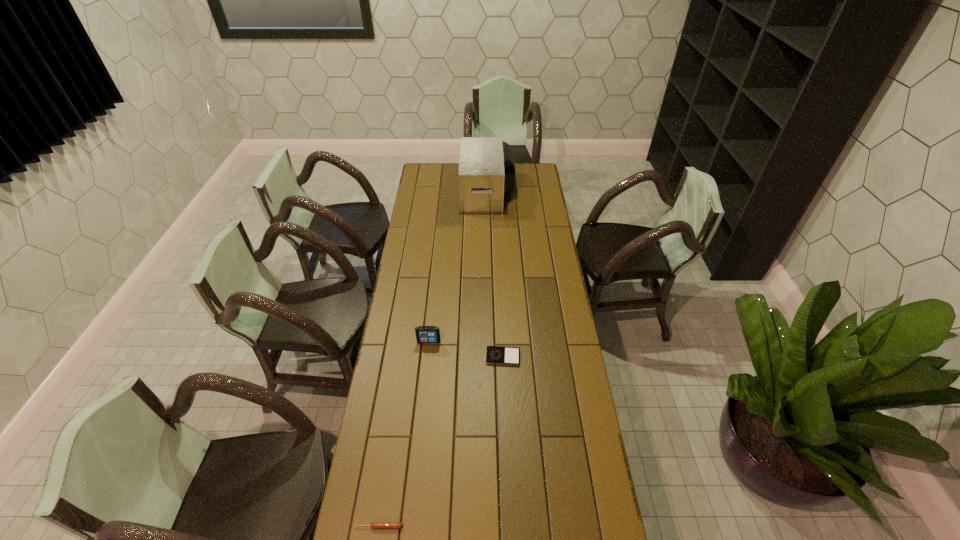
In order to click on vacant space situated on the front-facing side of the tallest object in this screenshot , I will do `click(436, 192)`.

Find the location of a particular element. vacant space located on the front screen of the second farthest object is located at coordinates (424, 381).

Locate an element on the screen. Image resolution: width=960 pixels, height=540 pixels. vacant area located on the right of the sausage is located at coordinates (429, 526).

Find the location of a particular element. The height and width of the screenshot is (540, 960). vacant space situated 0.230m on the back of the shortest object is located at coordinates pyautogui.click(x=501, y=306).

Locate an element on the screen. Image resolution: width=960 pixels, height=540 pixels. object that is at the far edge is located at coordinates (486, 173).

The image size is (960, 540). Find the location of `iPod at the left edge`. iPod at the left edge is located at coordinates (424, 334).

Locate an element on the screen. This screenshot has height=540, width=960. sausage that is positioned at the left edge is located at coordinates (374, 525).

You are a GUI agent. You are given a task and a screenshot of the screen. Output one action in this format:
    pyautogui.click(x=<x>, y=<y>)
    Task: Click on the free location at the far edge
    The image size is (960, 540).
    Given the screenshot: What is the action you would take?
    pyautogui.click(x=456, y=164)

Locate an element on the screen. free location at the left edge is located at coordinates (413, 363).

At what (x,y) coordinates should I click in order to perform the action: click on vacant area at the right edge of the desktop. Please return your answer as a coordinate pair (x, y). Looking at the image, I should click on (536, 195).